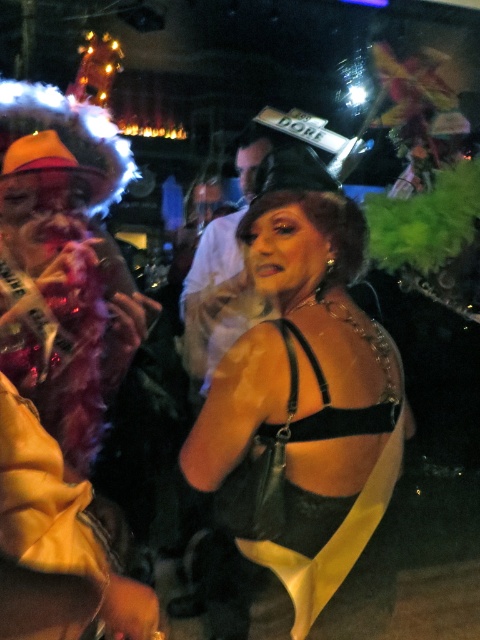
Locate an element on the screen. The height and width of the screenshot is (640, 480). velvet black dress at center is located at coordinates (325, 392).

Does velvet black dress at center have a lesser height compared to matte black tank top at center?

Yes.

The height and width of the screenshot is (640, 480). Find the location of `velvet black dress at center`. velvet black dress at center is located at coordinates (325, 392).